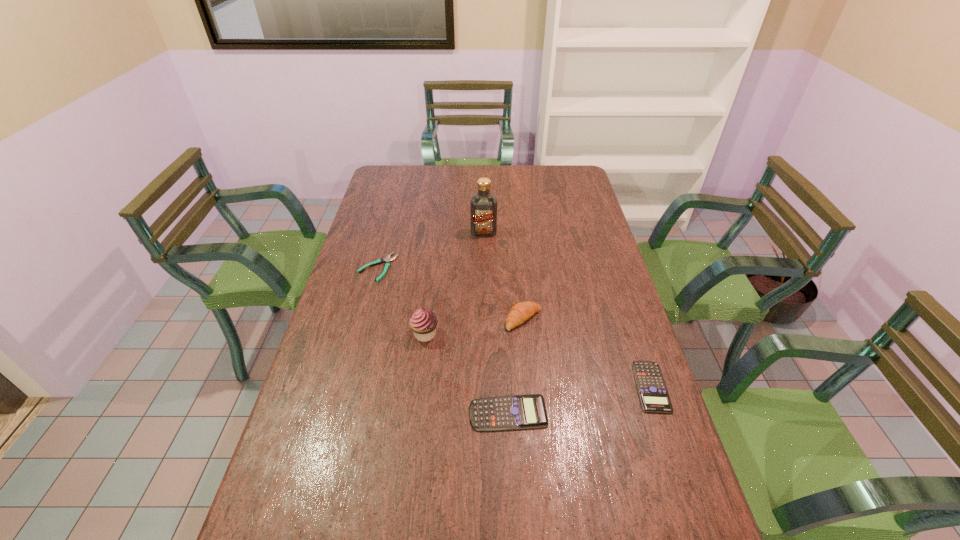
Find the location of a particular element. The width and height of the screenshot is (960, 540). vacant space at the left edge of the desktop is located at coordinates (321, 489).

I want to click on blank space at the right edge of the desktop, so click(x=586, y=265).

Find the location of a particular element. vacant space at the far left corner is located at coordinates (415, 168).

You are a GUI agent. You are given a task and a screenshot of the screen. Output one action in this format:
    pyautogui.click(x=<x>, y=<y>)
    Task: Click on the free space at the far right corner of the desktop
    The height and width of the screenshot is (540, 960).
    Given the screenshot: What is the action you would take?
    pyautogui.click(x=561, y=181)

Locate an element on the screen. The image size is (960, 540). vacant region between the second tallest object and the leftmost object is located at coordinates click(401, 301).

Where is `blank region between the third tallest object and the fifth object from right to left`? Image resolution: width=960 pixels, height=540 pixels. blank region between the third tallest object and the fifth object from right to left is located at coordinates point(474,326).

Locate an element on the screen. Image resolution: width=960 pixels, height=540 pixels. free space between the vodka and the second tallest object is located at coordinates (454, 283).

Identify the location of free space between the crescent roll and the farthest object. (504, 275).

This screenshot has height=540, width=960. What are the coordinates of `free space between the third tallest object and the rightmost object` in the screenshot? It's located at (588, 353).

Identify the location of free space that is in between the crescent roll and the vodka. (504, 275).